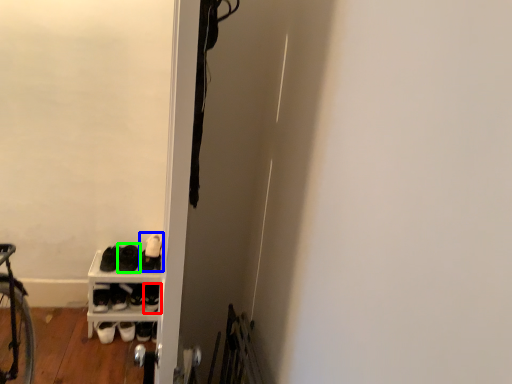
Question: Based on their relative distances, which object is farther from footwear (highlighted by a red box)? Choose from footwear (highlighted by a blue box) and footwear (highlighted by a green box).

Choices:
 (A) footwear
 (B) footwear

Answer: (A)